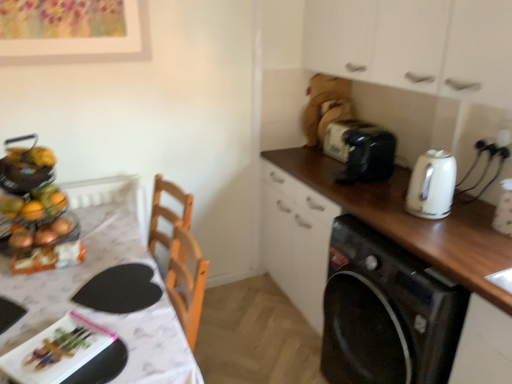
Question: From the image's perspective, would you say white matte cabinet at upper right is shown under white glossy table at left?

Choices:
 (A) no
 (B) yes

Answer: (A)

Question: Is white matte cabinet at upper right smaller than white glossy table at left?

Choices:
 (A) no
 (B) yes

Answer: (B)

Question: Does white matte cabinet at upper right appear on the right side of white glossy table at left?

Choices:
 (A) no
 (B) yes

Answer: (B)

Question: Can you confirm if white matte cabinet at upper right is wider than white glossy table at left?

Choices:
 (A) no
 (B) yes

Answer: (A)

Question: From a real-world perspective, is white matte cabinet at upper right positioned over white glossy table at left based on gravity?

Choices:
 (A) no
 (B) yes

Answer: (B)

Question: Is point (339, 125) positioned closer to the camera than point (373, 152)?

Choices:
 (A) closer
 (B) farther

Answer: (B)

Question: In the image, is black plastic toaster at upper right positioned in front of or behind black plastic toaster at upper right?

Choices:
 (A) behind
 (B) front

Answer: (A)

Question: Considering the positions of black plastic toaster at upper right and black plastic toaster at upper right in the image, is black plastic toaster at upper right bigger or smaller than black plastic toaster at upper right?

Choices:
 (A) big
 (B) small

Answer: (B)

Question: Looking at their shapes, would you say black plastic toaster at upper right is wider or thinner than black plastic toaster at upper right?

Choices:
 (A) wide
 (B) thin

Answer: (B)

Question: Does point (337, 135) appear closer or farther from the camera than point (65, 269)?

Choices:
 (A) closer
 (B) farther

Answer: (B)

Question: From the image's perspective, is black plastic toaster at upper right above or below white glossy table at left?

Choices:
 (A) below
 (B) above

Answer: (B)

Question: Considering the positions of black plastic toaster at upper right and white glossy table at left in the image, is black plastic toaster at upper right wider or thinner than white glossy table at left?

Choices:
 (A) wide
 (B) thin

Answer: (B)

Question: Is black plastic toaster at upper right taller or shorter than white glossy table at left?

Choices:
 (A) tall
 (B) short

Answer: (B)

Question: Looking at their shapes, would you say white glossy table at left is wider or thinner than metallic fruit basket at left?

Choices:
 (A) thin
 (B) wide

Answer: (B)

Question: Based on their sizes in the image, would you say white glossy table at left is bigger or smaller than metallic fruit basket at left?

Choices:
 (A) small
 (B) big

Answer: (B)